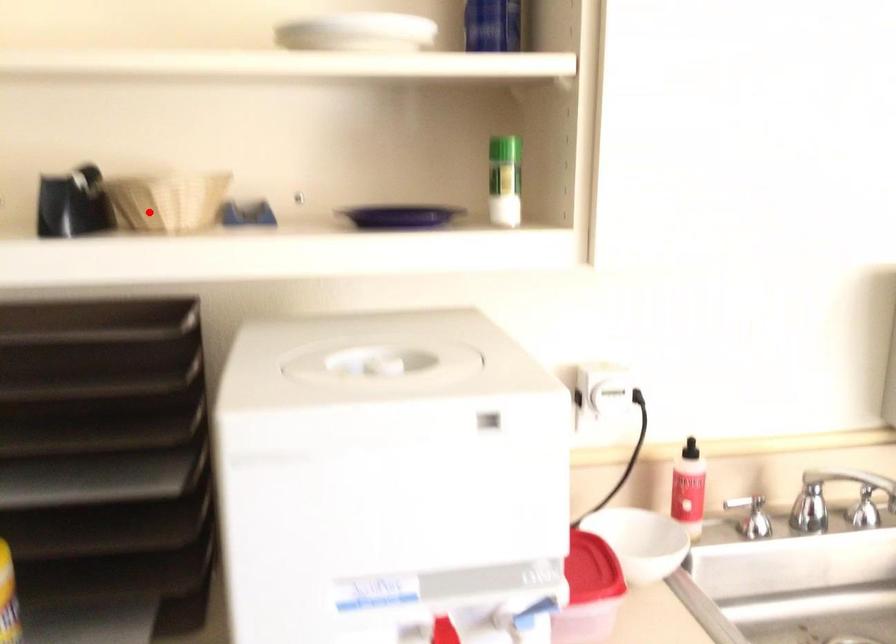
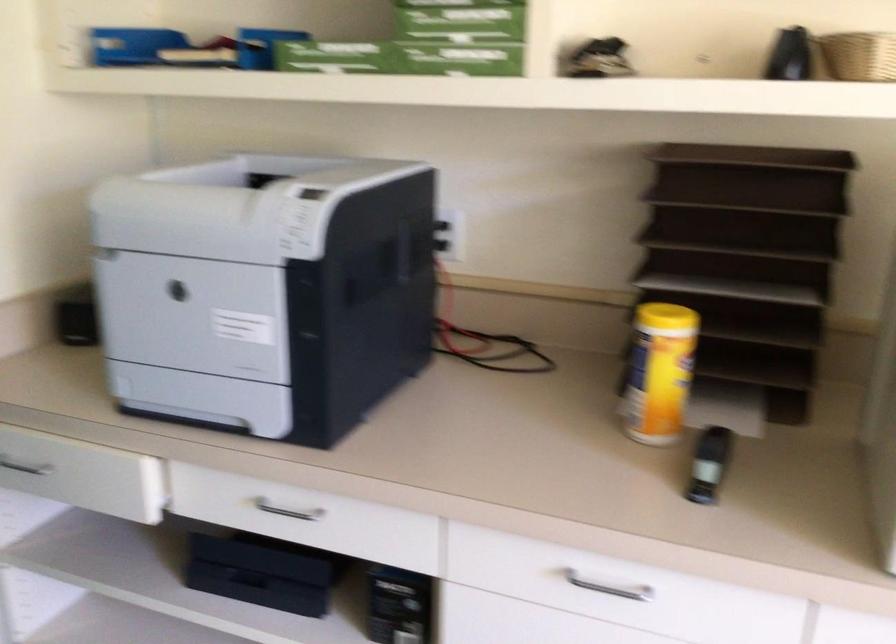
Question: I am providing you with two images of the same scene from different viewpoints. Image1 has a red point marked. In image2, the corresponding 3D location appears at what relative position? Reply with the corresponding letter.

Choices:
 (A) Closer
 (B) Farther

Answer: (B)